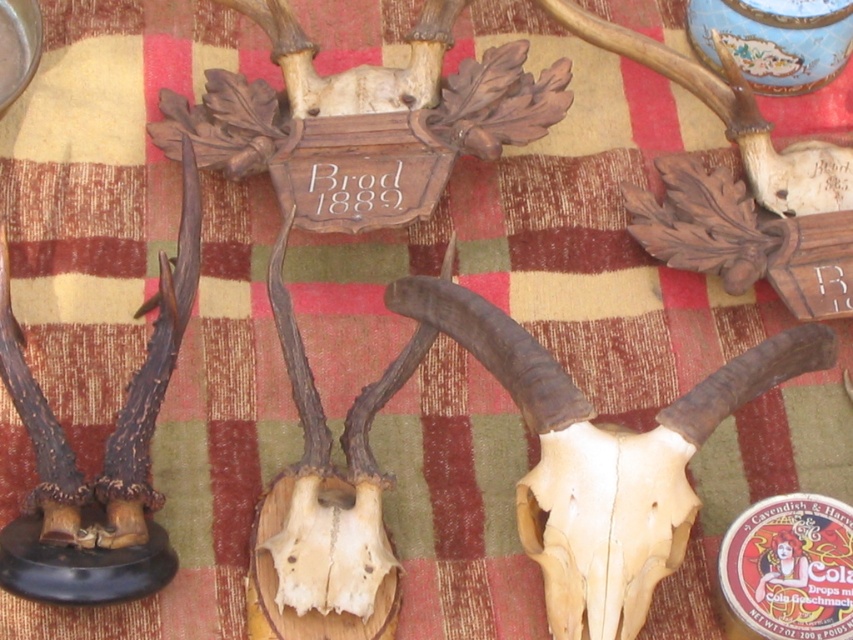
Question: Can you confirm if bone at center is wider than bone/smooth/skull at center?

Choices:
 (A) yes
 (B) no

Answer: (A)

Question: Can you confirm if bone at center is wider than bone/smooth/skull at center?

Choices:
 (A) no
 (B) yes

Answer: (B)

Question: Is bone at center to the left of bone/smooth/skull at center from the viewer's perspective?

Choices:
 (A) yes
 (B) no

Answer: (B)

Question: Which of the following is the closest to the observer?

Choices:
 (A) bone at center
 (B) bone/smooth/skull at center

Answer: (A)

Question: Which of the following is the closest to the observer?

Choices:
 (A) bone/smooth/skull at center
 (B) bone at center

Answer: (B)